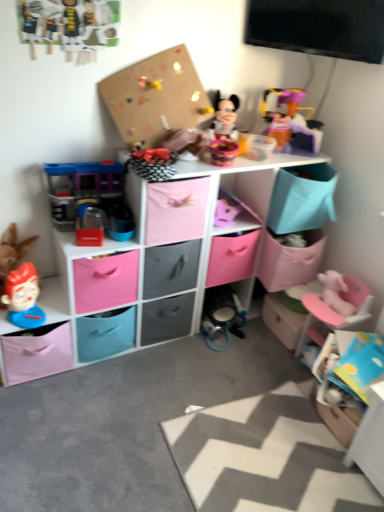
At what (x,y) coordinates should I click in order to perform the action: click on free space to the left of wooden toy at lower right, the second storage box viewed from the left. Please return your answer as a coordinate pair (x, y). This screenshot has height=512, width=384. Looking at the image, I should click on (254, 336).